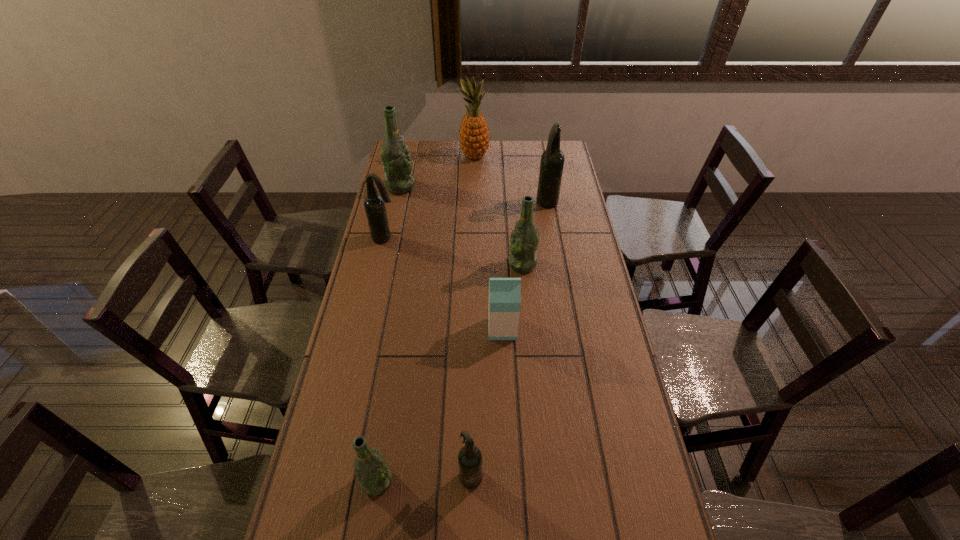
Identify the location of object that can be found as the fifth closest to the smallest green beer bottle. (552, 160).

Point out which beer bottle is positioned as the second nearest to the farthest object. Please provide its 2D coordinates. Your answer should be formatted as a tuple, i.e. [(x, y)], where the tuple contains the x and y coordinates of a point satisfying the conditions above.

[(552, 160)]

Choose which beer bottle is the second nearest neighbor to the second dark beer bottle from right to left. Please provide its 2D coordinates. Your answer should be formatted as a tuple, i.e. [(x, y)], where the tuple contains the x and y coordinates of a point satisfying the conditions above.

[(524, 240)]

Identify which green beer bottle is the third closest to the pineapple. Please provide its 2D coordinates. Your answer should be formatted as a tuple, i.e. [(x, y)], where the tuple contains the x and y coordinates of a point satisfying the conditions above.

[(374, 475)]

This screenshot has height=540, width=960. Find the location of `green beer bottle that is the second nearest to the seventh nearest object`. green beer bottle that is the second nearest to the seventh nearest object is located at coordinates 374,475.

You are a GUI agent. You are given a task and a screenshot of the screen. Output one action in this format:
    pyautogui.click(x=<x>, y=<y>)
    Task: Click on the dark beer bottle that is the closest to the biggest green beer bottle
    Image resolution: width=960 pixels, height=540 pixels.
    Given the screenshot: What is the action you would take?
    pyautogui.click(x=374, y=204)

In order to click on dark beer bottle that stands as the second closest to the white milk carton in this screenshot , I will do `click(374, 204)`.

Identify the location of blank space that satisfies the following two spatial constraints: 1. on the back side of the biggest dark beer bottle; 2. on the surface of the seventh nearest object. This screenshot has width=960, height=540. [x=544, y=187].

The width and height of the screenshot is (960, 540). I want to click on free space that satisfies the following two spatial constraints: 1. on the surface of the second farthest object; 2. on the left side of the white milk carton, so click(x=370, y=329).

You are a GUI agent. You are given a task and a screenshot of the screen. Output one action in this format:
    pyautogui.click(x=<x>, y=<y>)
    Task: Click on the vacant space that satisfies the following two spatial constraints: 1. on the surface of the nearest dark beer bottle; 2. on the left side of the farthest beer bottle
    The height and width of the screenshot is (540, 960).
    Given the screenshot: What is the action you would take?
    pyautogui.click(x=338, y=475)